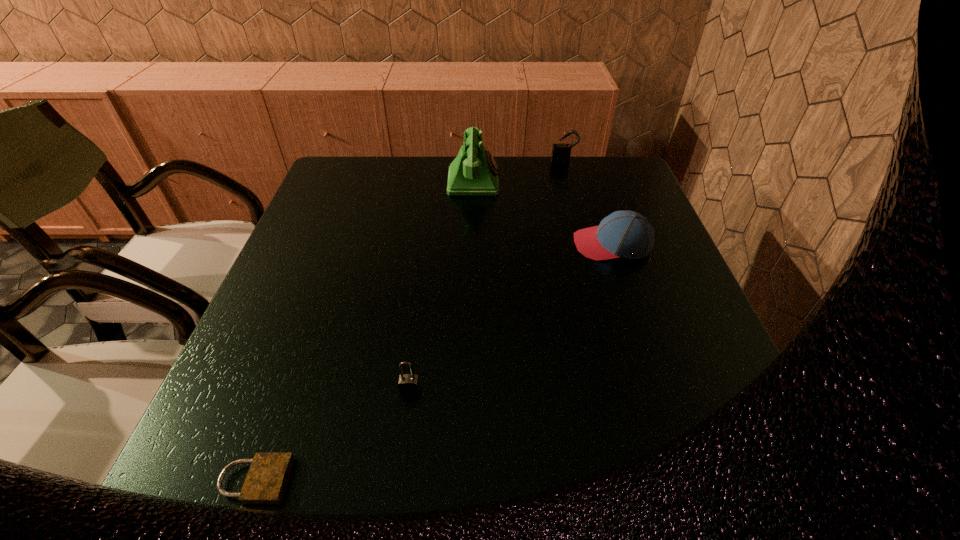
Identify the location of padlock that is at the right edge. The width and height of the screenshot is (960, 540). (561, 153).

Locate an element on the screen. The image size is (960, 540). baseball cap situated at the right edge is located at coordinates (624, 233).

The image size is (960, 540). What are the coordinates of `object positioned at the near left corner` in the screenshot? It's located at (265, 483).

Where is `object positioned at the far right corner`? object positioned at the far right corner is located at coordinates (561, 153).

This screenshot has width=960, height=540. I want to click on vacant region at the far edge of the desktop, so click(467, 199).

The width and height of the screenshot is (960, 540). Identify the location of vacant space at the near edge of the desktop. (310, 474).

This screenshot has width=960, height=540. In order to click on vacant space at the left edge of the desktop in this screenshot , I will do `click(298, 245)`.

In the image, there is a desktop. At what (x,y) coordinates should I click in order to perform the action: click on free region at the right edge. Please return your answer as a coordinate pair (x, y). Looking at the image, I should click on point(684,338).

Locate an element on the screen. The height and width of the screenshot is (540, 960). free space between the second object from left to right and the leftmost padlock is located at coordinates (332, 435).

You are a GUI agent. You are given a task and a screenshot of the screen. Output one action in this format:
    pyautogui.click(x=<x>, y=<y>)
    Task: Click on the empty location between the second padlock from left to right and the nearest object
    Image resolution: width=960 pixels, height=540 pixels.
    Given the screenshot: What is the action you would take?
    pyautogui.click(x=332, y=435)